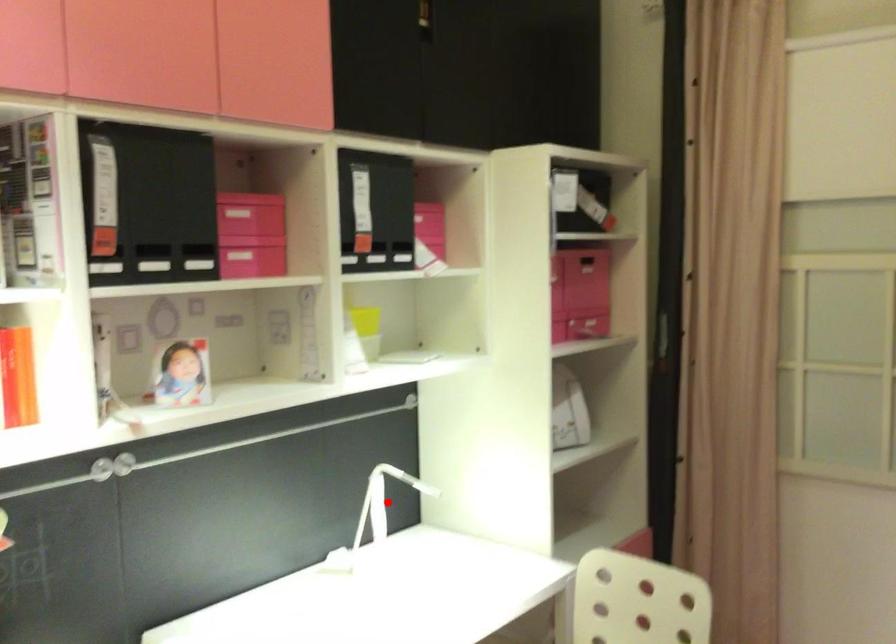
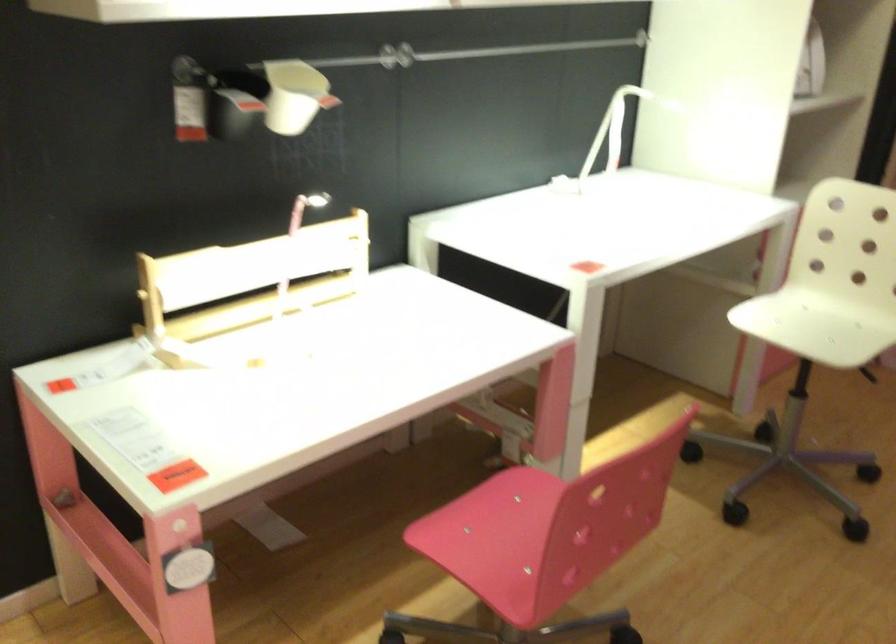
The point at the highlighted location is marked in the first image. Where is the corresponding point in the second image?

(618, 126)